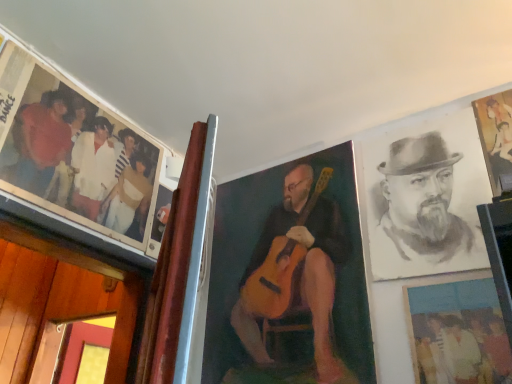
Question: Can you confirm if wooden frame at center, which is counted as the 3th picture frame, starting from the right, is smaller than matte black photo at upper left?

Choices:
 (A) no
 (B) yes

Answer: (B)

Question: Can you confirm if wooden frame at center, the first picture frame in the left-to-right sequence, is wider than matte black photo at upper left?

Choices:
 (A) yes
 (B) no

Answer: (B)

Question: From the image's perspective, is wooden frame at center, which is counted as the 3th picture frame, starting from the right, below matte black photo at upper left?

Choices:
 (A) no
 (B) yes

Answer: (B)

Question: Is wooden frame at center, the first picture frame in the left-to-right sequence, at the right side of matte black photo at upper left?

Choices:
 (A) yes
 (B) no

Answer: (A)

Question: Can you confirm if wooden frame at center, which is counted as the 3th picture frame, starting from the right, is taller than matte black photo at upper left?

Choices:
 (A) yes
 (B) no

Answer: (A)

Question: From the image's perspective, is wooden frame at center, the first picture frame in the left-to-right sequence, above matte black photo at upper left?

Choices:
 (A) yes
 (B) no

Answer: (B)

Question: Is matte plastic photo at lower right, which is counted as the 2th picture frame, starting from the right, positioned behind matte black photo at upper left?

Choices:
 (A) yes
 (B) no

Answer: (B)

Question: Could matte black photo at upper left be considered to be inside matte plastic photo at lower right, acting as the second picture frame starting from the left?

Choices:
 (A) yes
 (B) no

Answer: (B)

Question: Would you consider matte plastic photo at lower right, acting as the second picture frame starting from the left, to be distant from matte black photo at upper left?

Choices:
 (A) no
 (B) yes

Answer: (A)

Question: From the image's perspective, is matte plastic photo at lower right, acting as the second picture frame starting from the left, located beneath matte black photo at upper left?

Choices:
 (A) no
 (B) yes

Answer: (B)

Question: Is matte plastic photo at lower right, acting as the second picture frame starting from the left, smaller than matte black photo at upper left?

Choices:
 (A) yes
 (B) no

Answer: (A)

Question: Is matte plastic photo at lower right, acting as the second picture frame starting from the left, positioned with its back to matte black photo at upper left?

Choices:
 (A) yes
 (B) no

Answer: (B)

Question: From a real-world perspective, is wooden frame at center, which is counted as the 3th picture frame, starting from the right, located beneath matte plastic photo at lower right, which is counted as the 2th picture frame, starting from the right?

Choices:
 (A) no
 (B) yes

Answer: (A)